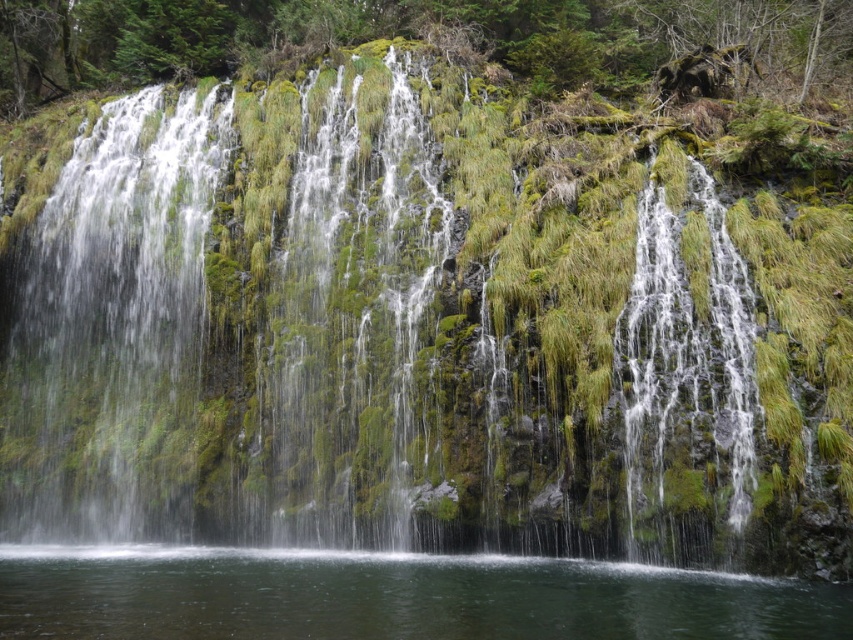
From the picture: You are a hiker who wants to cross from the green mossy rock at center to the clear water at center. Given that your hiking boots have a maximum safe stepping distance of 1.5 meters, can you safely make the jump? Please explain your reasoning.

The distance between the green mossy rock at center and the clear water at center is 15.32 meters. Since your hiking boots have a maximum safe stepping distance of 1.5 meters, this distance is far beyond the safe limit. Therefore, you cannot safely jump across.

You are standing at the base of the waterfall and want to reach the point labeled point (381, 406). However, there is an obstacle at point (738, 515) blocking your path. Can you safely walk around the obstacle to reach your destination?

Point (381, 406) is behind point (738, 515), so you can walk around the obstacle at point (738, 515) to reach your destination as long as there is a path available around it.